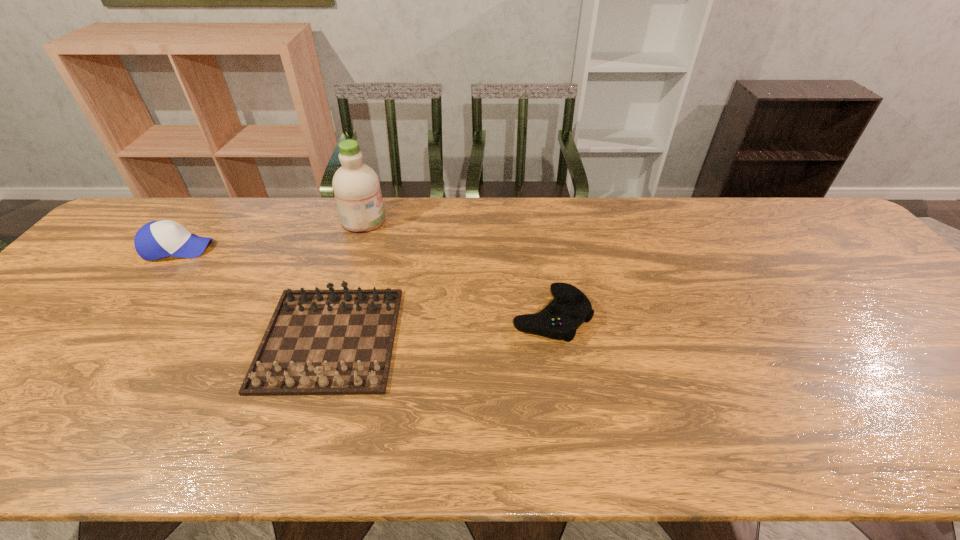
What are the coordinates of `the farthest object` in the screenshot? It's located at (356, 186).

Where is `cleansing agent`? This screenshot has height=540, width=960. cleansing agent is located at coordinates (356, 186).

You are a GUI agent. You are given a task and a screenshot of the screen. Output one action in this format:
    pyautogui.click(x=<x>, y=<y>)
    Task: Click on the third shortest object
    The width and height of the screenshot is (960, 540).
    Given the screenshot: What is the action you would take?
    pyautogui.click(x=157, y=239)

This screenshot has height=540, width=960. In order to click on baseball cap in this screenshot , I will do `click(157, 239)`.

Where is `chessboard`? chessboard is located at coordinates (318, 342).

Where is `the rightmost object`? The width and height of the screenshot is (960, 540). the rightmost object is located at coordinates (559, 320).

Locate an element on the screen. This screenshot has height=540, width=960. vacant space located 0.340m on the front label of the tallest object is located at coordinates (492, 220).

Find the location of a particular element. The height and width of the screenshot is (540, 960). free space located 0.140m on the front-facing side of the baseball cap is located at coordinates (259, 248).

At what (x,y) coordinates should I click in order to perform the action: click on vacant space located 0.260m on the right of the chessboard. Please return your answer as a coordinate pair (x, y). The image size is (960, 540). Looking at the image, I should click on (504, 339).

I want to click on vacant space located on the left of the rightmost object, so click(413, 315).